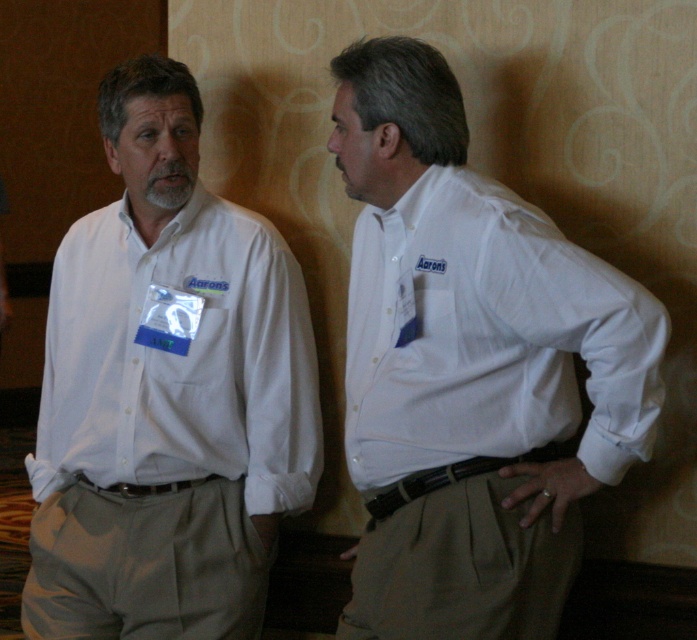
You are a photographer setting up for a group photo. You notice two people wearing white cotton shirts at the event. The person in the white cotton shirt at left is standing closer to the camera than the one in the white cotton shirt at right. To ensure both shirts are equally visible in the photo, should you adjust the camera angle upwards or downwards?

The white cotton shirt at right has a lesser height compared to the white cotton shirt at left. Since the person at left is closer to the camera and taller, adjusting the camera angle slightly downward would help balance their visibility by bringing the taller individual closer to the camera frame while allowing the shorter one to be seen more fully.

You are standing in a room where two men are talking. You see a white cotton shirt at right and a white cotton shirt at left. Which shirt is nearer to you?

The white cotton shirt at right is closer to the viewer than the white cotton shirt at left.

You are standing in a room where two men are talking. You see a white cotton shirt at right and a white cotton shirt at left. Which shirt is positioned more to the east side of the room?

The white cotton shirt at right is positioned more to the east side of the room because it is to the right of the white cotton shirt at left.